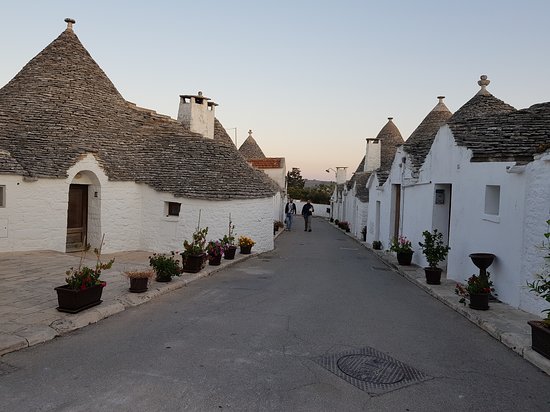
Find the location of a particular element. Image resolution: width=550 pixels, height=412 pixels. door is located at coordinates (78, 219), (448, 209), (398, 220).